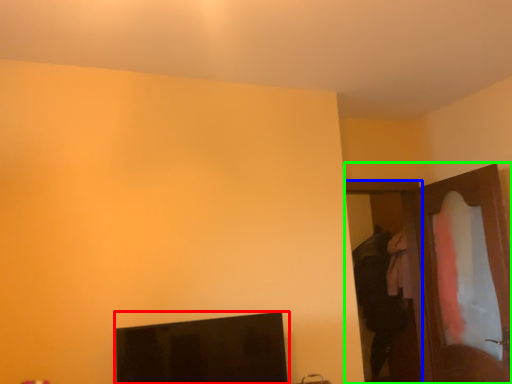
Question: Based on their relative distances, which object is farther from computer monitor (highlighted by a red box)? Choose from door (highlighted by a blue box) and dresser (highlighted by a green box).

Choices:
 (A) door
 (B) dresser

Answer: (A)